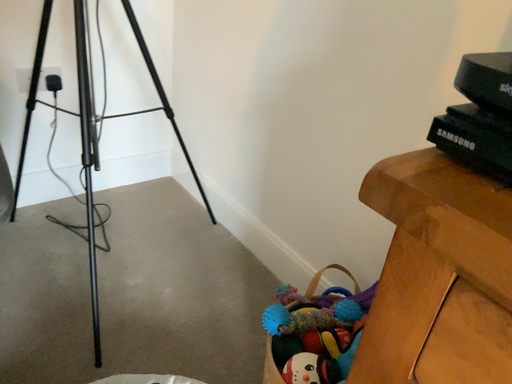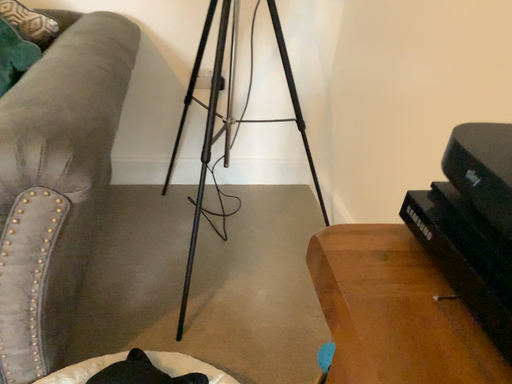
Question: Which way did the camera rotate in the video?

Choices:
 (A) rotated left
 (B) rotated right

Answer: (A)